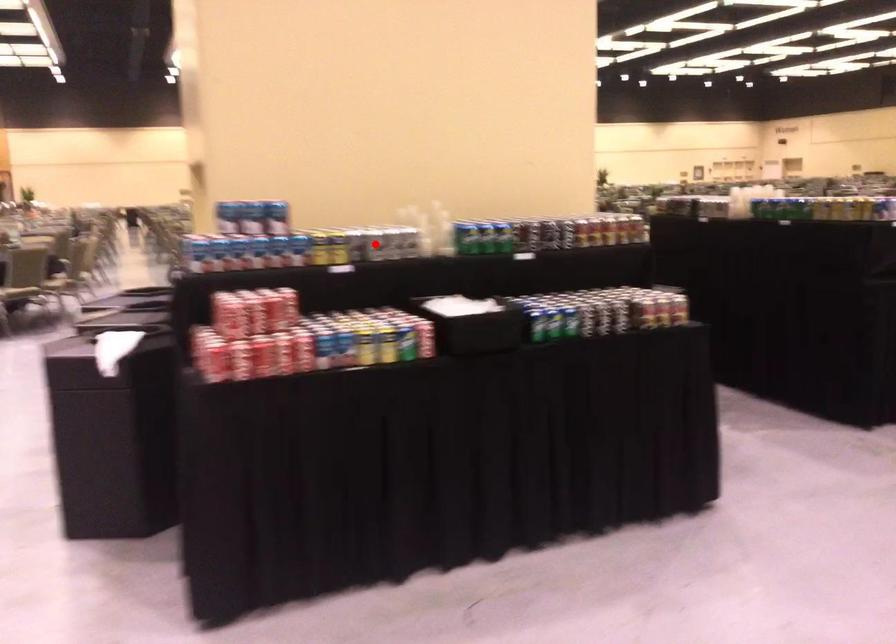
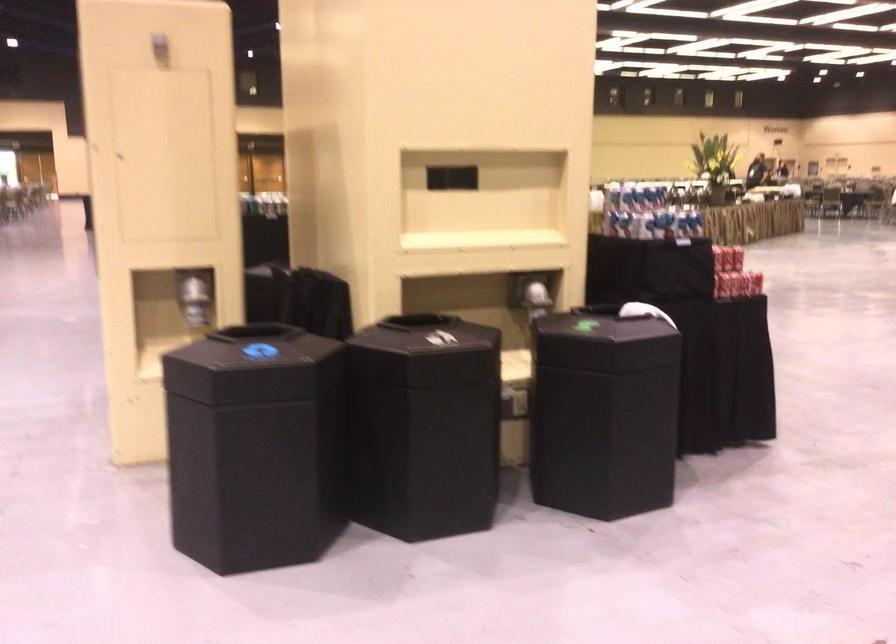
Question: I am providing you with two images of the same scene from different viewpoints. A red point is marked on the first image. Is the red point's position out of view in image 2?

Choices:
 (A) Yes
 (B) No

Answer: (A)